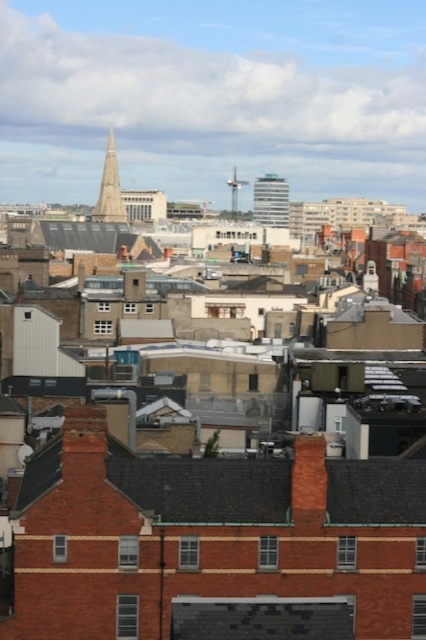
Is point (331, 461) farther from camera compared to point (118, 202)?

No, it is in front of (118, 202).

Can you confirm if red brick roof at lower left is positioned to the right of smooth glass spire at center?

Yes, red brick roof at lower left is to the right of smooth glass spire at center.

Which is in front, point (337, 513) or point (100, 188)?

Positioned in front is point (337, 513).

Where is `red brick roof at lower left`? The height and width of the screenshot is (640, 426). red brick roof at lower left is located at coordinates (206, 488).

Between point (118, 220) and point (238, 184), which one is positioned behind?

The point (238, 184) is behind.

Does point (124, 209) lie behind point (232, 205)?

That is False.

Identify the location of smooth glass spire at center. The height and width of the screenshot is (640, 426). (109, 189).

Does red brick roof at lower left lie in front of white glass building at center?

Yes.

Is red brick roof at lower left below white glass building at center?

Yes.

Does point (106, 468) lie in front of point (255, 184)?

That is True.

Identify the location of red brick roof at lower left. (206, 488).